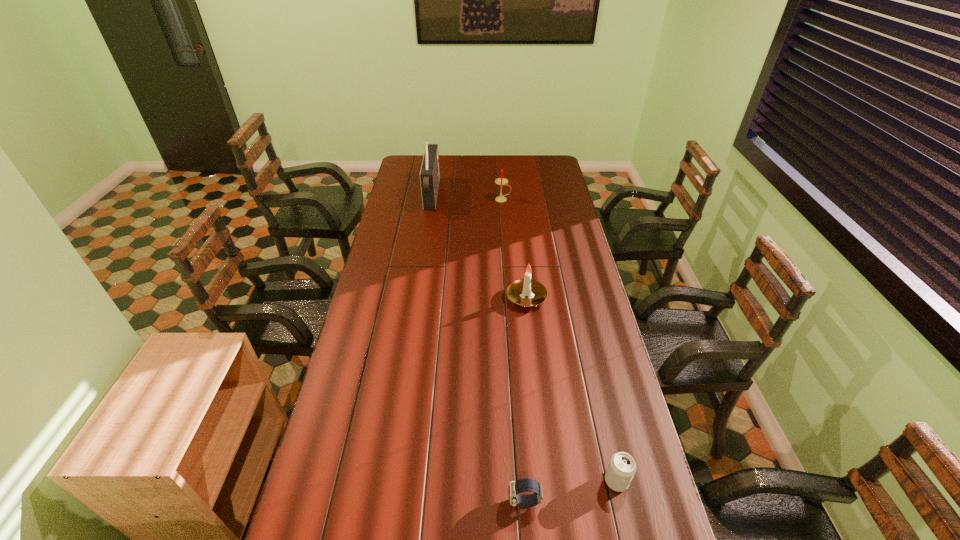
Image resolution: width=960 pixels, height=540 pixels. I want to click on free space located 0.120m on the face of the watch, so click(x=462, y=502).

Where is `vacant space located 0.230m on the face of the watch`? vacant space located 0.230m on the face of the watch is located at coordinates 420,502.

Locate an element on the screen. free point located 0.240m on the face of the watch is located at coordinates (416, 502).

This screenshot has height=540, width=960. Find the location of `object at the right edge`. object at the right edge is located at coordinates (622, 467).

Where is `vacant space at the left edge`? Image resolution: width=960 pixels, height=540 pixels. vacant space at the left edge is located at coordinates (418, 205).

What are the coordinates of `vacant area at the right edge of the desktop` in the screenshot? It's located at (625, 426).

The image size is (960, 540). In order to click on vacant space at the far right corner of the desktop in this screenshot , I will do `click(560, 169)`.

Image resolution: width=960 pixels, height=540 pixels. I want to click on unoccupied position between the can and the leftmost object, so click(x=524, y=338).

Locate an element on the screen. empty space between the third nearest object and the rightmost object is located at coordinates (571, 389).

This screenshot has height=540, width=960. I want to click on unoccupied area between the nearer candle and the rightmost object, so (571, 389).